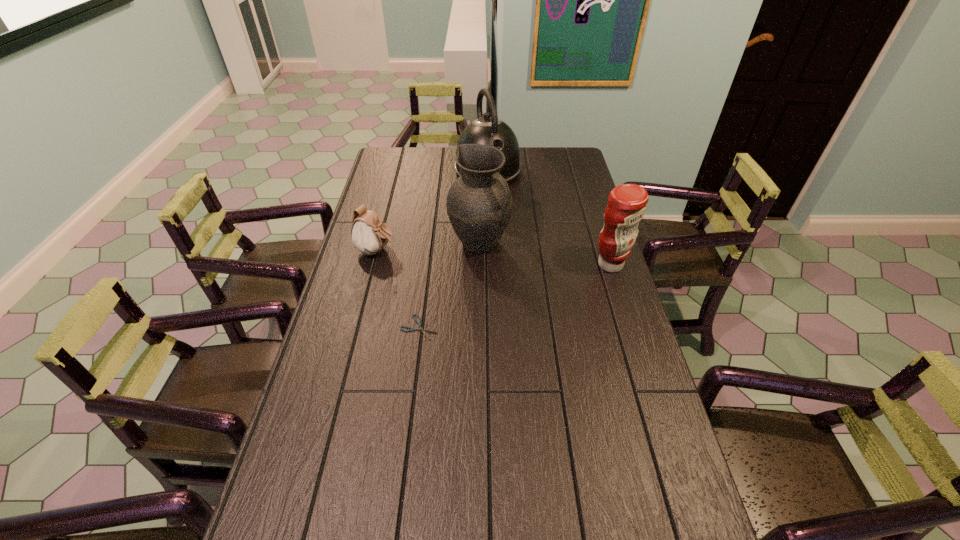
You are a GUI agent. You are given a task and a screenshot of the screen. Output one action in this format:
    pyautogui.click(x=<x>, y=<y>)
    Task: Click on the free space on the desktop that is between the nearest object and the condiment and is positioned on the side of the pitcher with the handle
    This screenshot has height=540, width=960.
    Given the screenshot: What is the action you would take?
    pyautogui.click(x=544, y=287)

Locate an element on the screen. This screenshot has height=540, width=960. free spot on the desktop that is between the shears and the condiment and is positioned on the spout of the farthest object is located at coordinates (548, 285).

This screenshot has width=960, height=540. In order to click on vacant space on the desktop that is between the shortest object and the rightmost object and is positioned on the front-facing side of the pouch in this screenshot , I will do `click(526, 293)`.